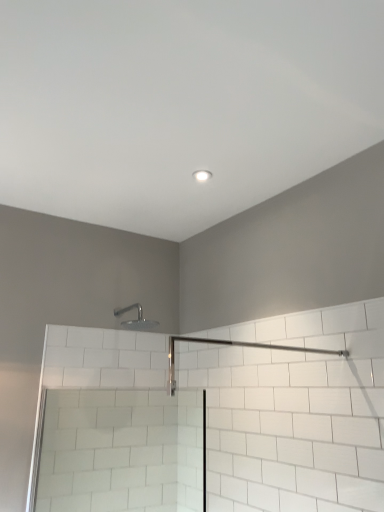
Question: Can you confirm if silver metallic shower head at upper center is thinner than white glossy light fixture at upper center?

Choices:
 (A) no
 (B) yes

Answer: (A)

Question: Does silver metallic shower head at upper center have a greater width compared to white glossy light fixture at upper center?

Choices:
 (A) no
 (B) yes

Answer: (B)

Question: Does silver metallic shower head at upper center come behind white glossy light fixture at upper center?

Choices:
 (A) yes
 (B) no

Answer: (A)

Question: Are silver metallic shower head at upper center and white glossy light fixture at upper center far apart?

Choices:
 (A) no
 (B) yes

Answer: (A)

Question: Can you confirm if silver metallic shower head at upper center is bigger than white glossy light fixture at upper center?

Choices:
 (A) yes
 (B) no

Answer: (A)

Question: From a real-world perspective, is silver metallic shower head at upper center beneath white glossy light fixture at upper center?

Choices:
 (A) yes
 (B) no

Answer: (A)

Question: Does clear glass screen door at lower left contain silver metallic shower head at upper center?

Choices:
 (A) yes
 (B) no

Answer: (B)

Question: Considering the relative sizes of clear glass screen door at lower left and silver metallic shower head at upper center in the image provided, is clear glass screen door at lower left shorter than silver metallic shower head at upper center?

Choices:
 (A) no
 (B) yes

Answer: (A)

Question: Is clear glass screen door at lower left at the right side of silver metallic shower head at upper center?

Choices:
 (A) yes
 (B) no

Answer: (B)

Question: Is clear glass screen door at lower left positioned in front of silver metallic shower head at upper center?

Choices:
 (A) no
 (B) yes

Answer: (B)

Question: Considering the relative sizes of clear glass screen door at lower left and silver metallic shower head at upper center in the image provided, is clear glass screen door at lower left smaller than silver metallic shower head at upper center?

Choices:
 (A) no
 (B) yes

Answer: (A)

Question: Is clear glass screen door at lower left not close to silver metallic shower head at upper center?

Choices:
 (A) yes
 (B) no

Answer: (B)

Question: Is silver metallic shower head at upper center positioned behind clear glass screen door at lower left?

Choices:
 (A) yes
 (B) no

Answer: (A)